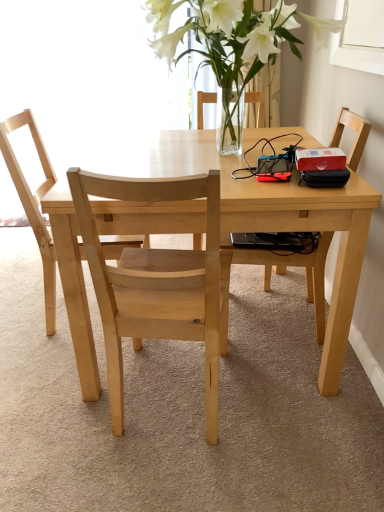
At what (x,y) coordinates should I click in order to perform the action: click on vacant point to the left of natural wood chair at center, the 3th chair from the right. Please return your answer as a coordinate pair (x, y). The image size is (384, 512). Looking at the image, I should click on (19, 308).